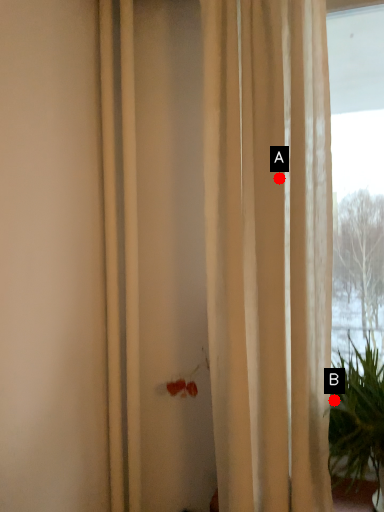
Question: Two points are circled on the image, labeled by A and B beside each circle. Among these points, which one is farthest from the camera?

Choices:
 (A) A is further
 (B) B is further

Answer: (B)